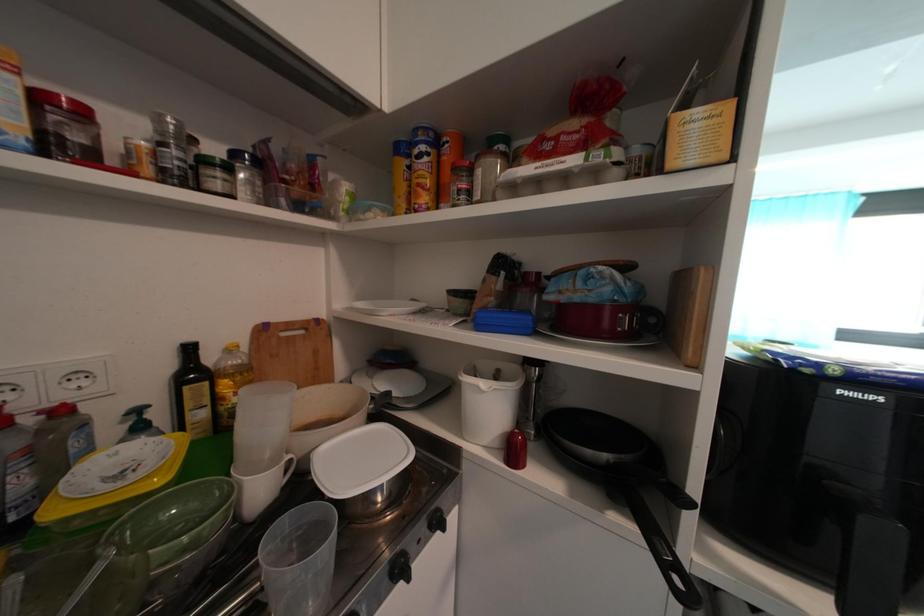
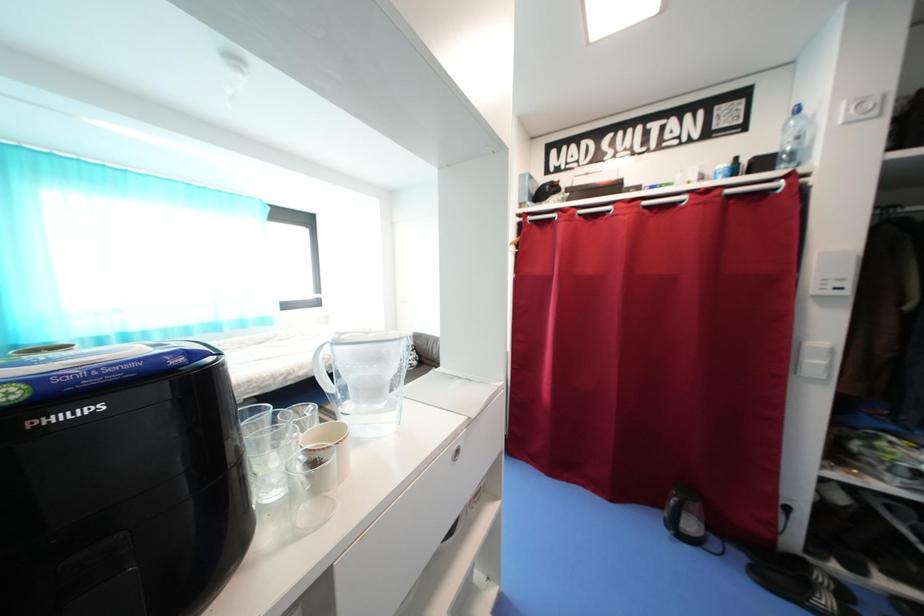
Question: The images are taken continuously from a first-person perspective. In which direction is your viewpoint rotating?

Choices:
 (A) Left
 (B) Right
 (C) Up
 (D) Down

Answer: (B)